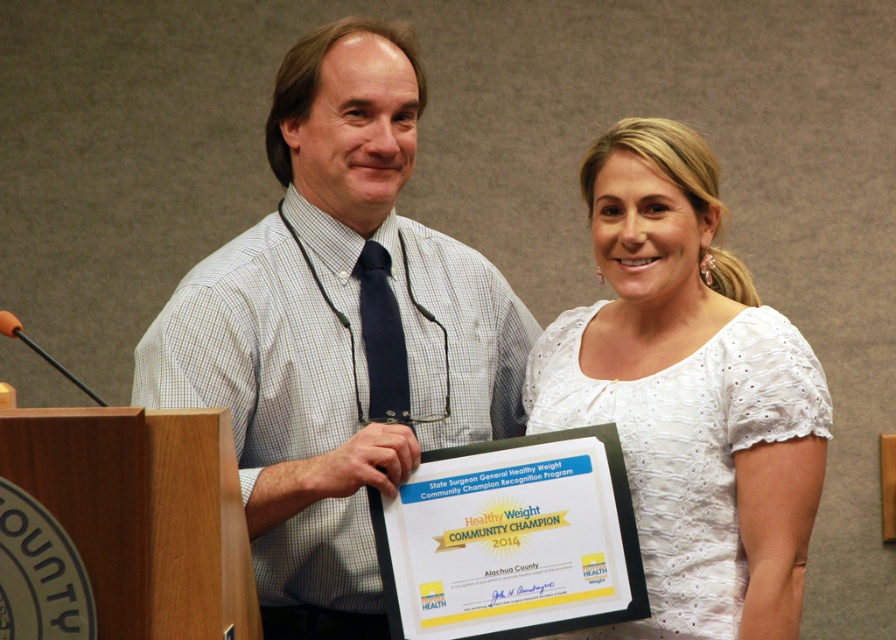
Question: Does white checkered shirt at center appear over white lace dress at center?

Choices:
 (A) no
 (B) yes

Answer: (B)

Question: Is the position of white checkered shirt at center more distant than that of white lace dress at center?

Choices:
 (A) yes
 (B) no

Answer: (A)

Question: Which of the following is the farthest from the observer?

Choices:
 (A) white checkered shirt at center
 (B) white lace dress at center

Answer: (A)

Question: Which of the following is the closest to the observer?

Choices:
 (A) (392, 182)
 (B) (650, 164)

Answer: (B)

Question: Can you confirm if white checkered shirt at center is thinner than white lace dress at center?

Choices:
 (A) no
 (B) yes

Answer: (A)